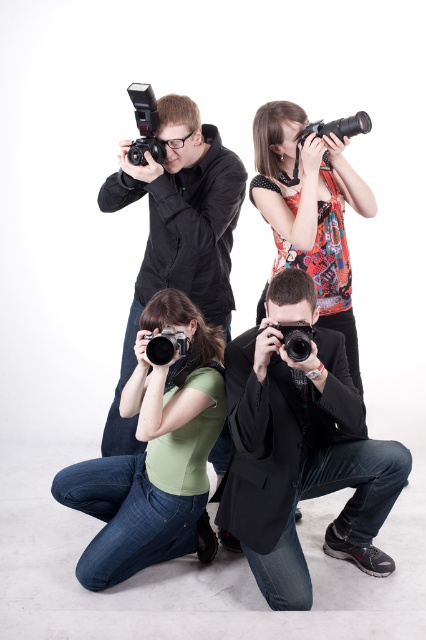
Between black matte camera at center and printed fabric top at upper right, which one is positioned higher?

printed fabric top at upper right is higher up.

Who is taller, black matte camera at center or printed fabric top at upper right?

printed fabric top at upper right is taller.

The width and height of the screenshot is (426, 640). What do you see at coordinates (301, 451) in the screenshot? I see `black matte camera at center` at bounding box center [301, 451].

Where is `black matte camera at center`? Image resolution: width=426 pixels, height=640 pixels. black matte camera at center is located at coordinates (301, 451).

Is point (377, 454) less distant than point (360, 115)?

That is True.

Is point (310, 314) behind point (319, 120)?

No, (310, 314) is closer to viewer.

Where is `black matte camera at center`? The image size is (426, 640). black matte camera at center is located at coordinates (301, 451).

This screenshot has height=640, width=426. In order to click on green matte shirt at lower left in this screenshot , I will do `click(154, 452)`.